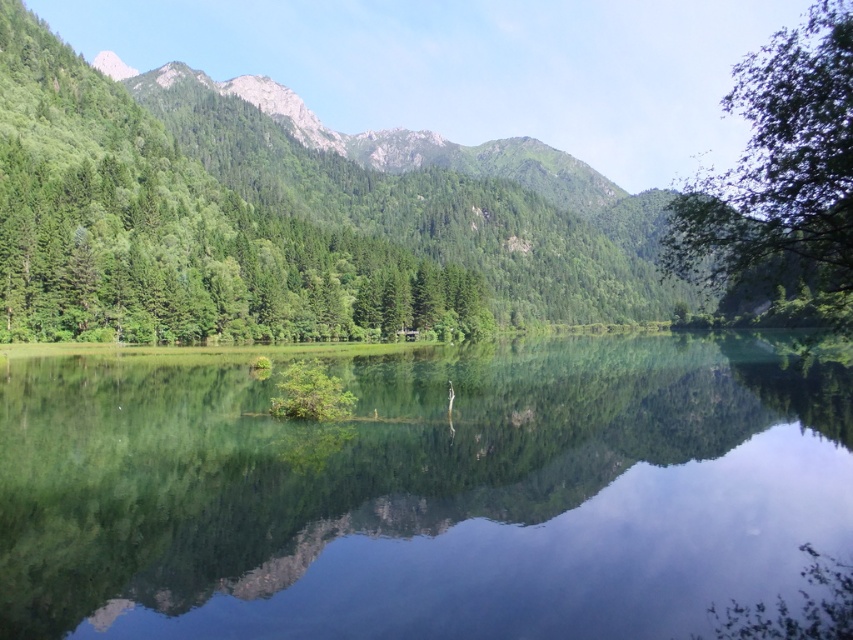
Is green matte tree at left positioned before green leafy tree at upper right?

No, green matte tree at left is behind green leafy tree at upper right.

Does green matte tree at left lie behind green leafy tree at upper right?

Yes, it is.

Measure the distance between green matte tree at left and camera.

103.32 meters

What are the coordinates of `green matte tree at left` in the screenshot? It's located at (173, 230).

Can you confirm if green reflective water at center is positioned to the left of green matte tree at left?

In fact, green reflective water at center is to the right of green matte tree at left.

The height and width of the screenshot is (640, 853). What are the coordinates of `green reflective water at center` in the screenshot? It's located at (422, 492).

Who is more distant from viewer, (468, 628) or (149, 198)?

Point (149, 198)

At what (x,y) coordinates should I click in order to perform the action: click on green reflective water at center. Please return your answer as a coordinate pair (x, y). Looking at the image, I should click on (422, 492).

Does green reflective water at center lie behind green leafy tree at upper right?

No, green reflective water at center is in front of green leafy tree at upper right.

Which is below, green reflective water at center or green leafy tree at upper right?

green reflective water at center

The image size is (853, 640). What do you see at coordinates (422, 492) in the screenshot?
I see `green reflective water at center` at bounding box center [422, 492].

The image size is (853, 640). What are the coordinates of `green reflective water at center` in the screenshot? It's located at 422,492.